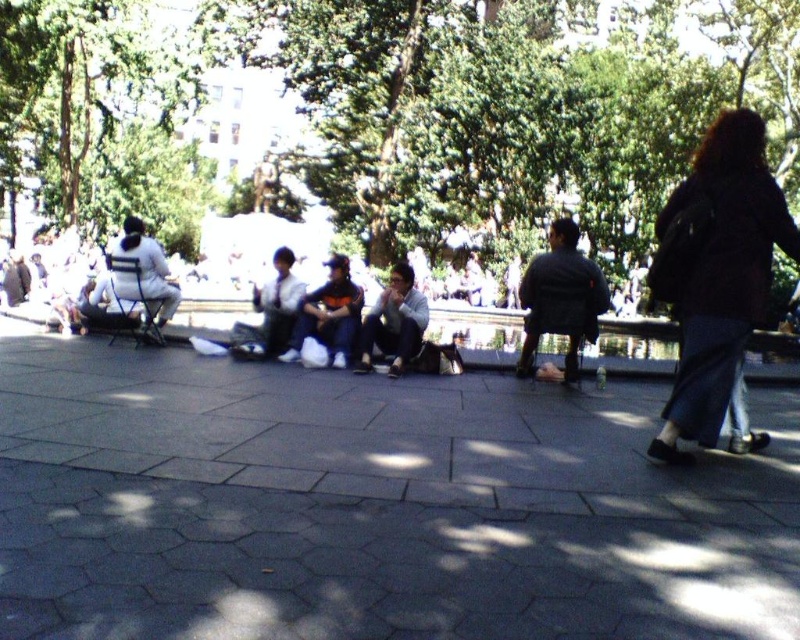
You are standing at the point with coordinates 0.5, 0.7 in the image. You want to place a small potted plant exactly 0.1 units to the right of the dark gray jacket at center. What are the coordinates of where you should place the plant?

The dark gray jacket at center is located at point (560, 298). To place the plant 0.1 units to the right, add 0.1 to the x coordinate. The new coordinates would be (560, 362).

You are a photographer standing near the white fabric jacket at left and the matte black jacket at center in the park scene. You want to take a photo that includes both jackets in the frame. Given that your camera has a maximum focal length that allows capturing objects within a 5 meter distance, will you be able to include both jackets in the same photo?

The white fabric jacket at left is 4.72 meters away from the matte black jacket at center. Since the distance between them is less than 5 meters, the photographer can include both jackets in the same photo using the camera with a maximum focal length that allows capturing objects within a 5 meter distance.

You are a photographer trying to capture both the light gray fabric jacket at center and the matte black jacket at center in the same frame. Based on their positions, which jacket do you think might require more space in the composition to avoid being cut off?

The light gray fabric jacket at center might require more space in the composition because it is wider than the matte black jacket at center according to the description.